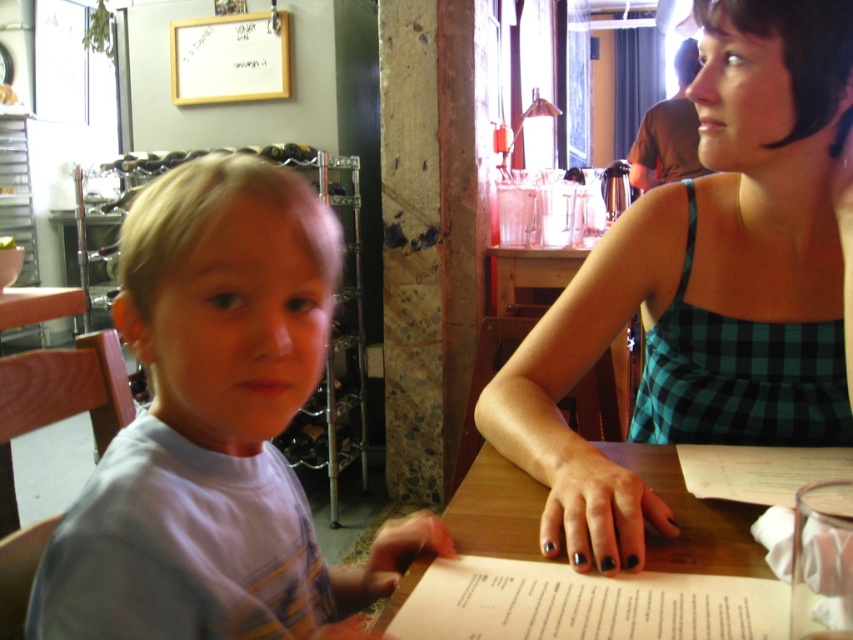
Question: Considering the real-world distances, which object is closest to the green checkered dress at upper right?

Choices:
 (A) wooden table at center
 (B) light blue t-shirt at left

Answer: (A)

Question: Which point is closer to the camera?

Choices:
 (A) wooden table at center
 (B) light blue t-shirt at left
 (C) white paper menu at lower center
 (D) green checkered dress at upper right

Answer: (B)

Question: Does green checkered dress at upper right appear on the right side of white paper menu at lower center?

Choices:
 (A) no
 (B) yes

Answer: (B)

Question: Which of the following is the farthest from the observer?

Choices:
 (A) (500, 566)
 (B) (720, 52)
 (C) (155, 620)

Answer: (B)

Question: Observing the image, what is the correct spatial positioning of light blue t-shirt at left in reference to wooden table at center?

Choices:
 (A) above
 (B) below

Answer: (A)

Question: Considering the relative positions of green checkered dress at upper right and wooden table at center in the image provided, where is green checkered dress at upper right located with respect to wooden table at center?

Choices:
 (A) above
 (B) below

Answer: (A)